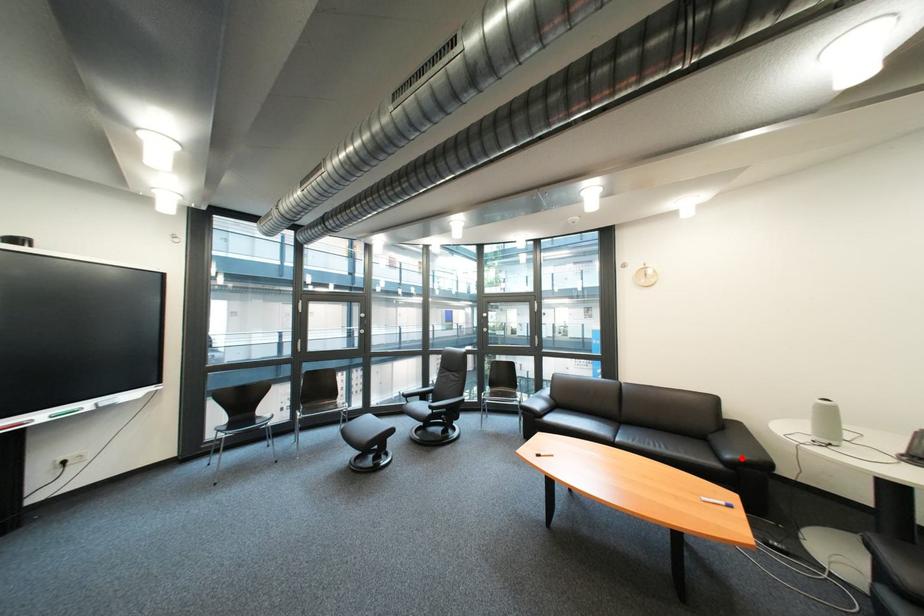
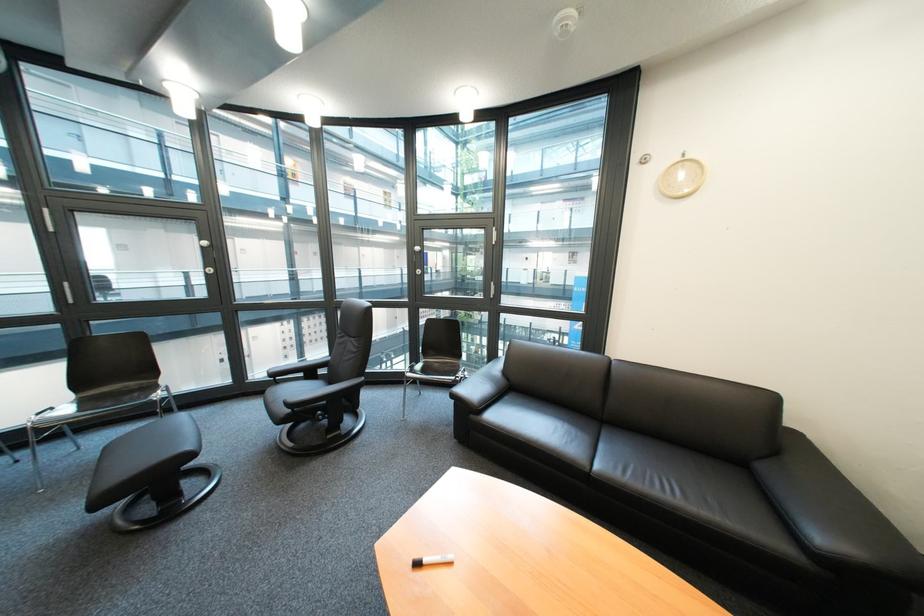
Question: A red point is marked in image1. In image2, is the corresponding 3D point closer to the camera or farther? Reply with the corresponding letter.

Choices:
 (A) The corresponding 3D point is closer.
 (B) The corresponding 3D point is farther.

Answer: (A)